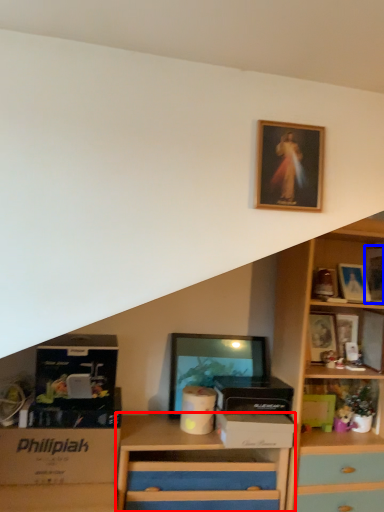
Question: Which object appears farthest to the camera in this image, chest of drawers (highlighted by a red box) or picture frame (highlighted by a blue box)?

Choices:
 (A) chest of drawers
 (B) picture frame

Answer: (B)